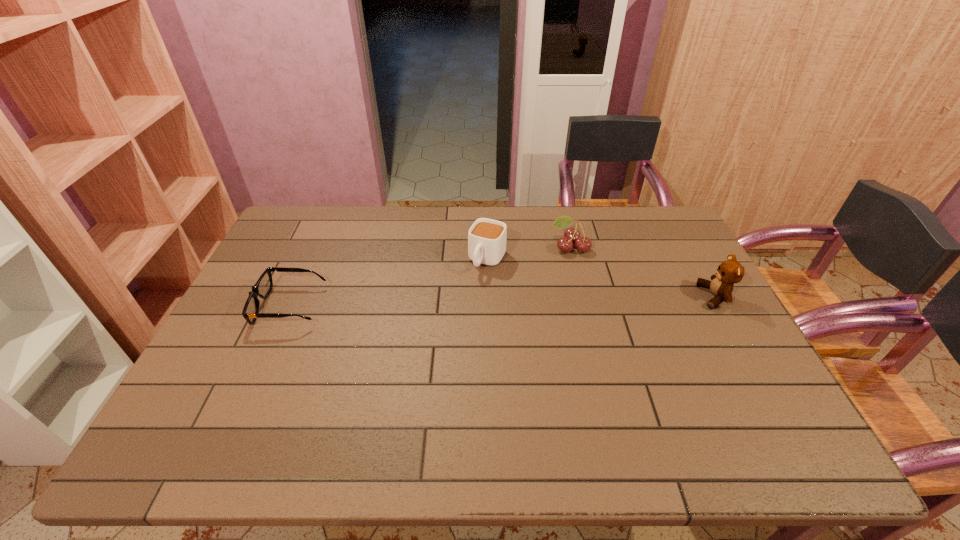
The width and height of the screenshot is (960, 540). I want to click on the leftmost object, so click(x=262, y=288).

Where is `sunglasses`? The width and height of the screenshot is (960, 540). sunglasses is located at coordinates (262, 288).

This screenshot has height=540, width=960. I want to click on the rightmost object, so click(730, 271).

The width and height of the screenshot is (960, 540). Identify the location of the tallest object. (730, 271).

The height and width of the screenshot is (540, 960). Identify the location of the second object from right to left. (572, 235).

Locate an element on the screen. Image resolution: width=960 pixels, height=540 pixels. cup is located at coordinates (487, 238).

Identify the location of vacant area situated on the front-facing side of the rightmost object. The image size is (960, 540). (662, 296).

Where is `free space located 0.170m on the front-facing side of the rightmost object`? free space located 0.170m on the front-facing side of the rightmost object is located at coordinates (642, 296).

In order to click on free space located on the front-facing side of the rightmost object in this screenshot , I will do `click(660, 296)`.

You are a GUI agent. You are given a task and a screenshot of the screen. Output one action in this format:
    pyautogui.click(x=<x>, y=<y>)
    Task: Click on the vacant position located 0.060m on the leaves of the second object from right to left
    This screenshot has height=540, width=960.
    Given the screenshot: What is the action you would take?
    click(557, 266)